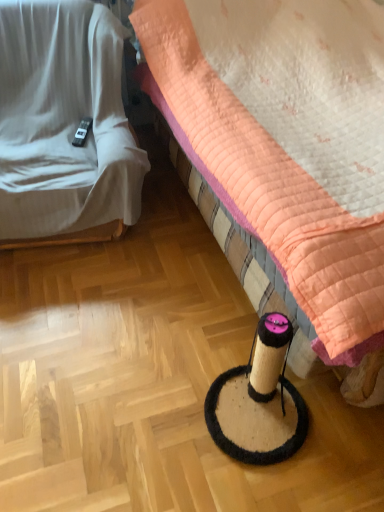
Question: Does white fabric couch at left have a smaller size compared to quilted peach bed at center?

Choices:
 (A) yes
 (B) no

Answer: (A)

Question: Considering the relative sizes of white fabric couch at left and quilted peach bed at center in the image provided, is white fabric couch at left bigger than quilted peach bed at center?

Choices:
 (A) no
 (B) yes

Answer: (A)

Question: Would you consider white fabric couch at left to be distant from quilted peach bed at center?

Choices:
 (A) no
 (B) yes

Answer: (A)

Question: From the image's perspective, is white fabric couch at left on quilted peach bed at center?

Choices:
 (A) no
 (B) yes

Answer: (B)

Question: Does white fabric couch at left have a lesser width compared to quilted peach bed at center?

Choices:
 (A) yes
 (B) no

Answer: (A)

Question: From the image's perspective, does white fabric couch at left appear lower than quilted peach bed at center?

Choices:
 (A) no
 (B) yes

Answer: (A)

Question: Is quilted peach bed at center thinner than white fabric couch at left?

Choices:
 (A) no
 (B) yes

Answer: (A)

Question: Does quilted peach bed at center appear on the left side of white fabric couch at left?

Choices:
 (A) no
 (B) yes

Answer: (A)

Question: Is quilted peach bed at center at the right side of white fabric couch at left?

Choices:
 (A) yes
 (B) no

Answer: (A)

Question: Is quilted peach bed at center taller than white fabric couch at left?

Choices:
 (A) no
 (B) yes

Answer: (B)

Question: From the image's perspective, is quilted peach bed at center on top of white fabric couch at left?

Choices:
 (A) no
 (B) yes

Answer: (A)

Question: Considering the relative sizes of quilted peach bed at center and white fabric couch at left in the image provided, is quilted peach bed at center shorter than white fabric couch at left?

Choices:
 (A) no
 (B) yes

Answer: (A)

Question: Is white fabric couch at left taller or shorter than quilted peach bed at center?

Choices:
 (A) short
 (B) tall

Answer: (A)